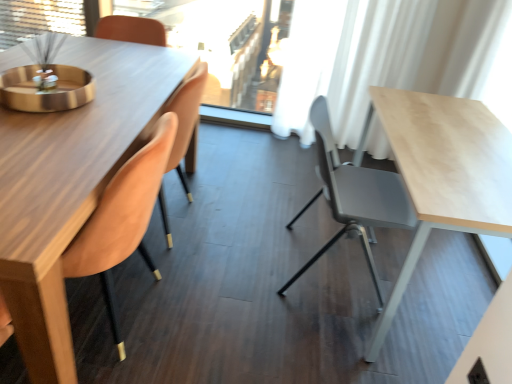
Question: Can we say white sheer curtain at upper center lies outside velvet orange chair at left, the 2th chair when ordered from right to left?

Choices:
 (A) yes
 (B) no

Answer: (A)

Question: Is white sheer curtain at upper center to the right of velvet orange chair at left, which appears as the 1th chair when viewed from the left, from the viewer's perspective?

Choices:
 (A) no
 (B) yes

Answer: (B)

Question: Considering the relative sizes of white sheer curtain at upper center and velvet orange chair at left, which appears as the 1th chair when viewed from the left, in the image provided, is white sheer curtain at upper center wider than velvet orange chair at left, which appears as the 1th chair when viewed from the left,?

Choices:
 (A) no
 (B) yes

Answer: (A)

Question: Is white sheer curtain at upper center looking in the opposite direction of velvet orange chair at left, which appears as the 1th chair when viewed from the left?

Choices:
 (A) no
 (B) yes

Answer: (A)

Question: Considering the relative sizes of white sheer curtain at upper center and velvet orange chair at left, which appears as the 1th chair when viewed from the left, in the image provided, is white sheer curtain at upper center bigger than velvet orange chair at left, which appears as the 1th chair when viewed from the left,?

Choices:
 (A) no
 (B) yes

Answer: (B)

Question: From a real-world perspective, is white sheer curtain at upper center physically above velvet orange chair at left, which appears as the 1th chair when viewed from the left?

Choices:
 (A) yes
 (B) no

Answer: (A)

Question: Could you tell me if matte gray chair at center, which is the 1th chair from right to left, is facing white sheer curtain at upper right?

Choices:
 (A) yes
 (B) no

Answer: (B)

Question: Is matte gray chair at center, the 2th chair positioned from the left, outside white sheer curtain at upper right?

Choices:
 (A) yes
 (B) no

Answer: (A)

Question: Is matte gray chair at center, which is the 1th chair from right to left, turned away from white sheer curtain at upper right?

Choices:
 (A) yes
 (B) no

Answer: (B)

Question: Does matte gray chair at center, the 2th chair positioned from the left, have a lesser width compared to white sheer curtain at upper right?

Choices:
 (A) yes
 (B) no

Answer: (B)

Question: From a real-world perspective, is matte gray chair at center, which is the 1th chair from right to left, positioned over white sheer curtain at upper right based on gravity?

Choices:
 (A) yes
 (B) no

Answer: (B)

Question: From a real-world perspective, is matte gray chair at center, which is the 1th chair from right to left, located beneath white sheer curtain at upper right?

Choices:
 (A) no
 (B) yes

Answer: (B)

Question: Does velvet orange chair at left, the 2th chair when ordered from right to left, have a larger size compared to white sheer curtain at upper center?

Choices:
 (A) yes
 (B) no

Answer: (B)